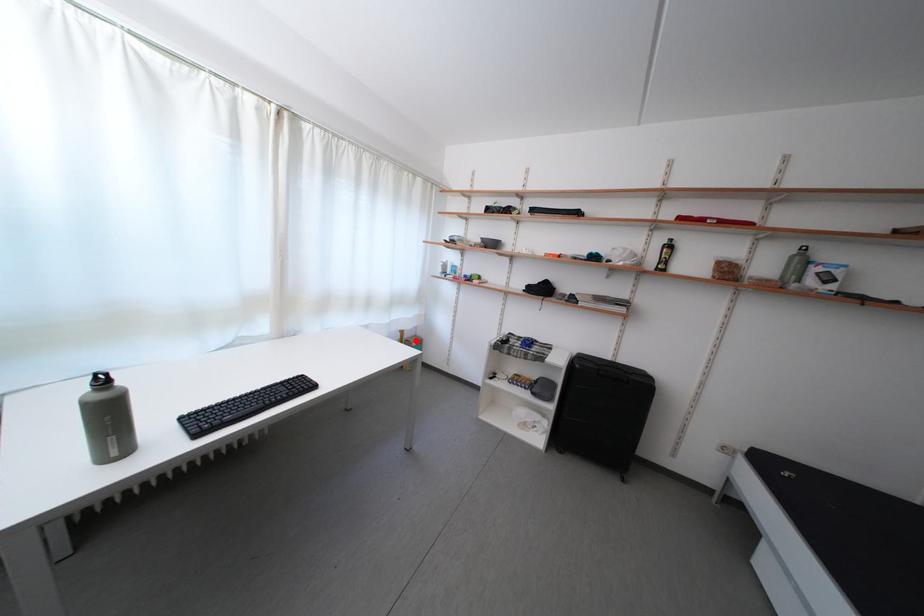
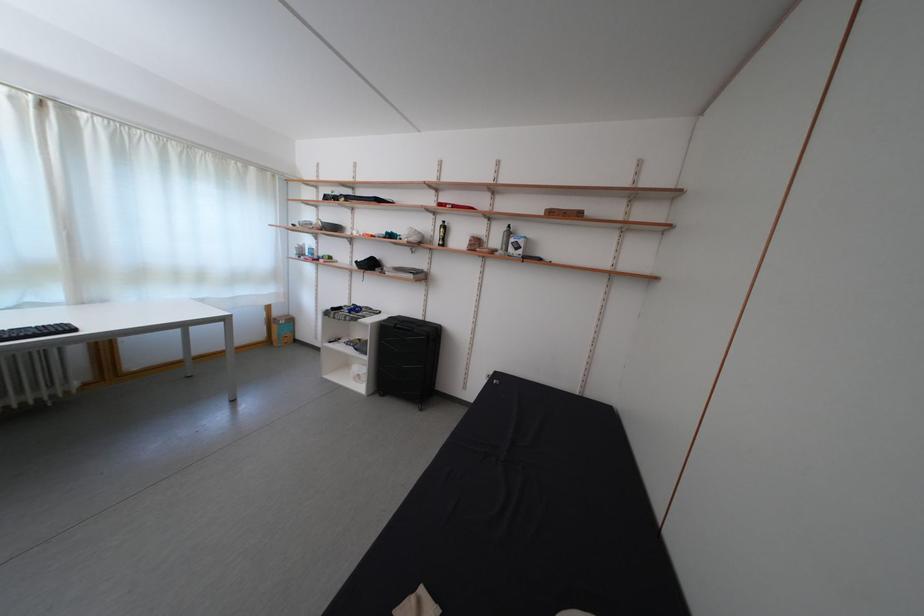
Where in the second image is the point corresponding to the highlighted location from the first image?

(285, 320)